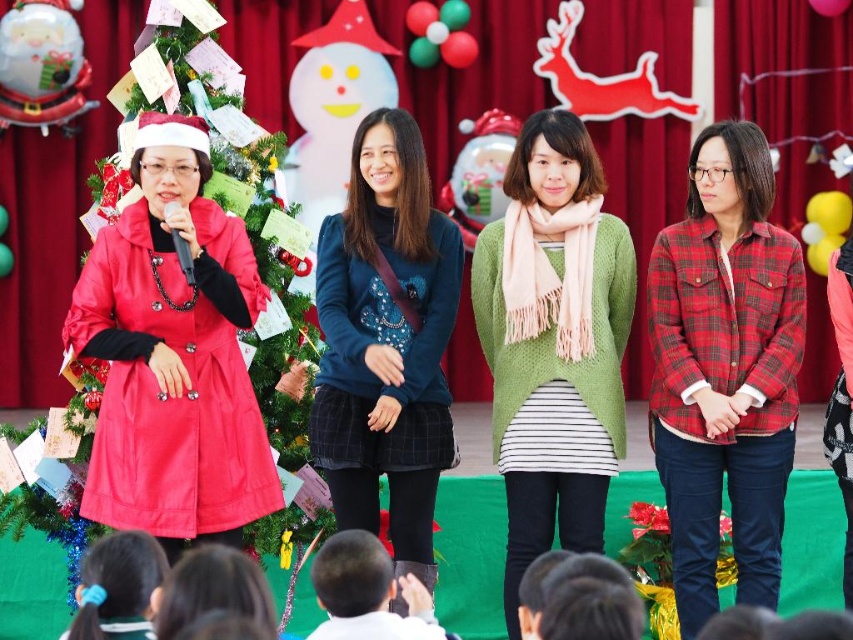
Is point (102, 262) positioned after point (428, 275)?

No, (102, 262) is closer to viewer.

Describe the element at coordinates (173, 355) in the screenshot. The height and width of the screenshot is (640, 853). I see `matte red coat at left` at that location.

Where is `matte red coat at left`? This screenshot has height=640, width=853. matte red coat at left is located at coordinates (173, 355).

Is green knitted sweater at center further to the viewer compared to dark blue sweater at center?

Yes, green knitted sweater at center is behind dark blue sweater at center.

Between green knitted sweater at center and dark blue sweater at center, which one has more height?

Standing taller between the two is green knitted sweater at center.

Is point (541, 300) farther from camera compared to point (431, 582)?

Yes, it is.

This screenshot has height=640, width=853. I want to click on green knitted sweater at center, so click(553, 342).

Between point (90, 337) and point (715, 541), which one is positioned in front?

Point (90, 337) is more forward.

Is point (248, 408) behind point (682, 273)?

No, it is not.

Identify the location of matte red coat at left. The width and height of the screenshot is (853, 640). (173, 355).